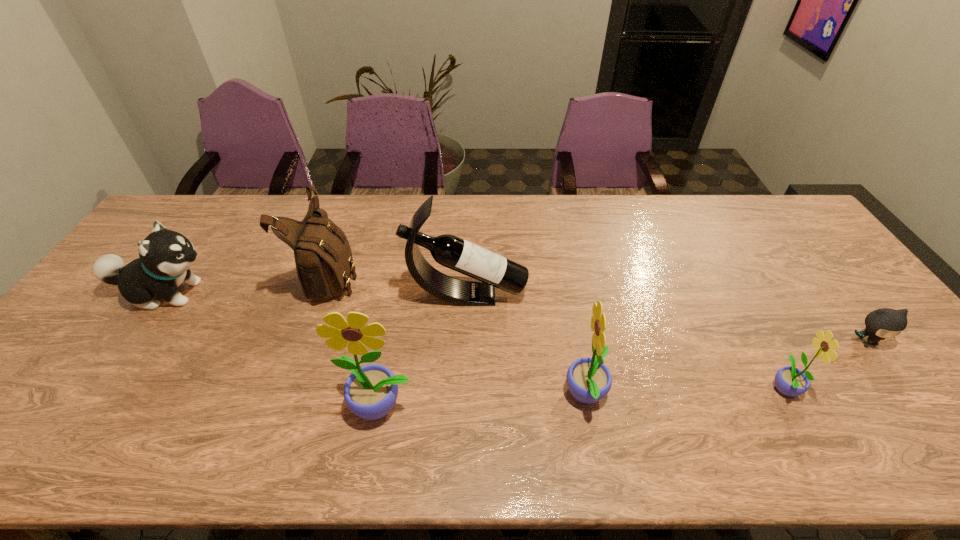
Where is `the leftmost sunflower`? The image size is (960, 540). the leftmost sunflower is located at coordinates (370, 392).

Locate an element on the screen. This screenshot has width=960, height=540. the fifth object from left to right is located at coordinates (589, 380).

Locate an element on the screen. Image resolution: width=960 pixels, height=540 pixels. the second sunflower from left to right is located at coordinates (589, 380).

This screenshot has height=540, width=960. I want to click on the sixth object from left to right, so click(x=789, y=380).

You are a GUI agent. You are given a task and a screenshot of the screen. Output one action in this format:
    pyautogui.click(x=<x>, y=<y>)
    Task: Click on the shortest sunflower
    The width and height of the screenshot is (960, 540).
    Given the screenshot: What is the action you would take?
    pyautogui.click(x=789, y=380)

The height and width of the screenshot is (540, 960). I want to click on the leftmost object, so click(x=165, y=256).

Find the location of a particular element. Image resolution: width=960 pixels, height=540 pixels. the sixth object from right to left is located at coordinates (323, 257).

This screenshot has height=540, width=960. I want to click on the rightmost object, so click(x=882, y=323).

Locate an element on the screen. This screenshot has height=540, width=960. the fourth nearest object is located at coordinates (882, 323).

Find the location of a particular element. wine bottle is located at coordinates (493, 270).